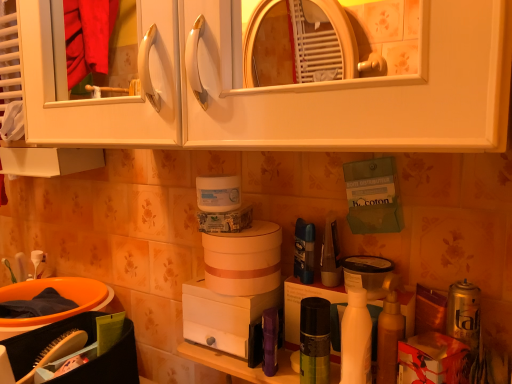
Question: From a real-world perspective, is green matte spray can at center, placed as the 1th toiletry when sorted from right to left, below white matte cabinet at upper center?

Choices:
 (A) no
 (B) yes

Answer: (B)

Question: From the image's perspective, is green matte spray can at center, placed as the 1th toiletry when sorted from right to left, above white matte cabinet at upper center?

Choices:
 (A) no
 (B) yes

Answer: (A)

Question: Is green matte spray can at center, placed as the 1th toiletry when sorted from right to left, thinner than white matte cabinet at upper center?

Choices:
 (A) no
 (B) yes

Answer: (B)

Question: Considering the relative sizes of green matte spray can at center, which ranks as the 2th toiletry in left-to-right order, and white matte cabinet at upper center in the image provided, is green matte spray can at center, which ranks as the 2th toiletry in left-to-right order, taller than white matte cabinet at upper center?

Choices:
 (A) yes
 (B) no

Answer: (B)

Question: Can you confirm if green matte spray can at center, which ranks as the 2th toiletry in left-to-right order, is positioned to the left of white matte cabinet at upper center?

Choices:
 (A) no
 (B) yes

Answer: (A)

Question: Based on their sizes in the image, would you say translucent plastic mouthwash at center right is bigger or smaller than white matte bottle at center right?

Choices:
 (A) small
 (B) big

Answer: (A)

Question: Considering the positions of translucent plastic mouthwash at center right and white matte bottle at center right in the image, is translucent plastic mouthwash at center right wider or thinner than white matte bottle at center right?

Choices:
 (A) thin
 (B) wide

Answer: (A)

Question: From a real-world perspective, is translucent plastic mouthwash at center right positioned above or below white matte bottle at center right?

Choices:
 (A) below
 (B) above

Answer: (B)

Question: From the image's perspective, relative to white matte bottle at center right, is translucent plastic mouthwash at center right above or below?

Choices:
 (A) below
 (B) above

Answer: (B)

Question: In terms of size, does white matte cabinet at upper center appear bigger or smaller than orange plastic basin at lower left?

Choices:
 (A) small
 (B) big

Answer: (B)

Question: From a real-world perspective, is white matte cabinet at upper center physically located above or below orange plastic basin at lower left?

Choices:
 (A) above
 (B) below

Answer: (A)

Question: In the image, is white matte cabinet at upper center on the left side or the right side of orange plastic basin at lower left?

Choices:
 (A) right
 (B) left

Answer: (A)

Question: Is white matte cabinet at upper center in front of or behind orange plastic basin at lower left in the image?

Choices:
 (A) front
 (B) behind

Answer: (A)

Question: In terms of size, does white matte bottle at center right appear bigger or smaller than green matte spray can at center, placed as the 1th toiletry when sorted from right to left?

Choices:
 (A) big
 (B) small

Answer: (A)

Question: From the image's perspective, is white matte bottle at center right located above or below green matte spray can at center, placed as the 1th toiletry when sorted from right to left?

Choices:
 (A) below
 (B) above

Answer: (B)